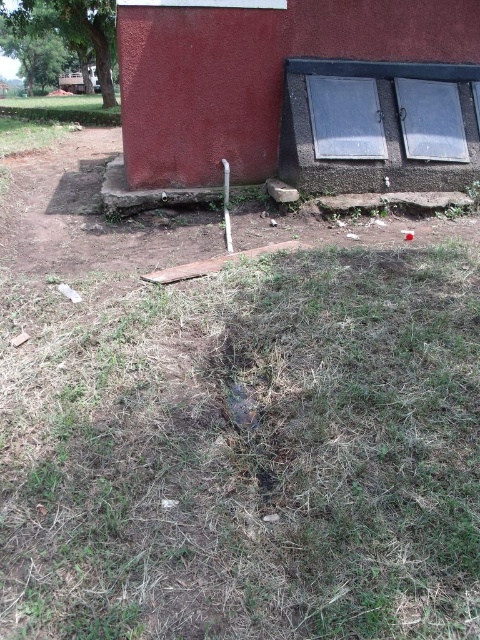
Is point (384, 324) less distant than point (148, 140)?

Yes, it is in front of point (148, 140).

Which is below, brown dry grass at center or smooth red barn at center?

brown dry grass at center is below.

What do you see at coordinates (247, 452) in the screenshot?
I see `brown dry grass at center` at bounding box center [247, 452].

I want to click on brown dry grass at center, so click(x=247, y=452).